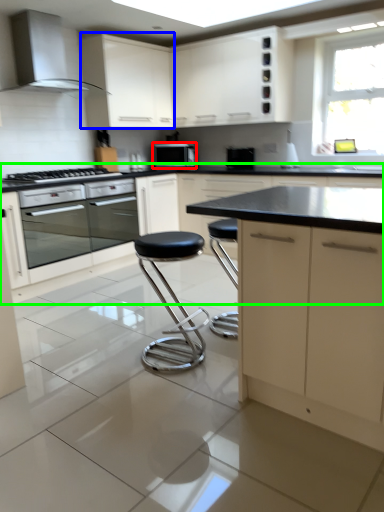
Question: Considering the real-world distances, which object is farthest from kitchen appliance (highlighted by a red box)? cabinetry (highlighted by a blue box) or cabinetry (highlighted by a green box)?

Choices:
 (A) cabinetry
 (B) cabinetry

Answer: (B)